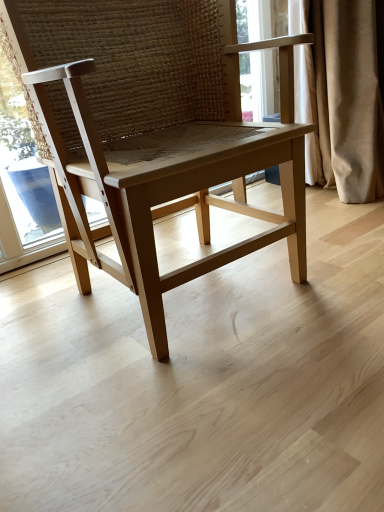
Locate an element on the screen. This screenshot has width=384, height=512. free spot in front of light wood chair at center is located at coordinates (197, 399).